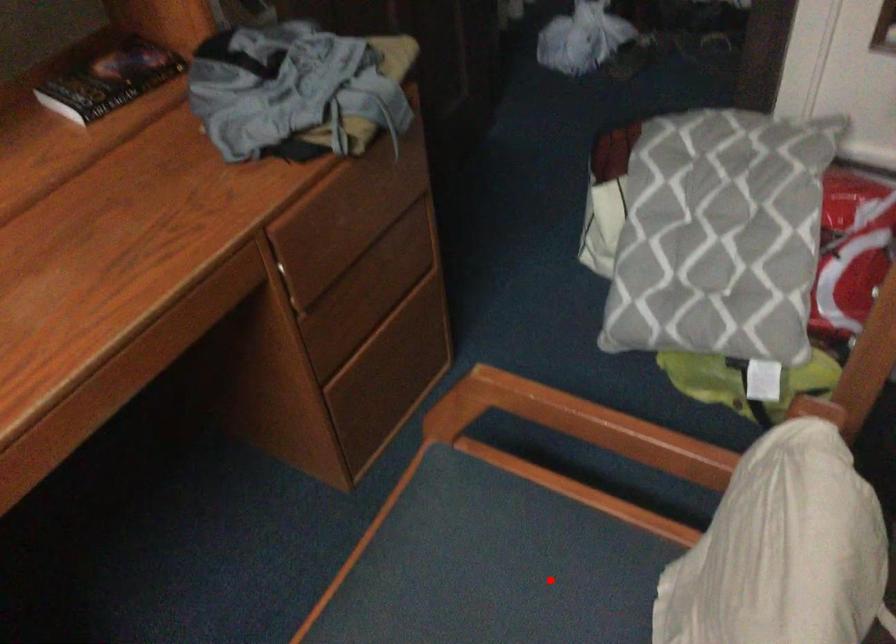
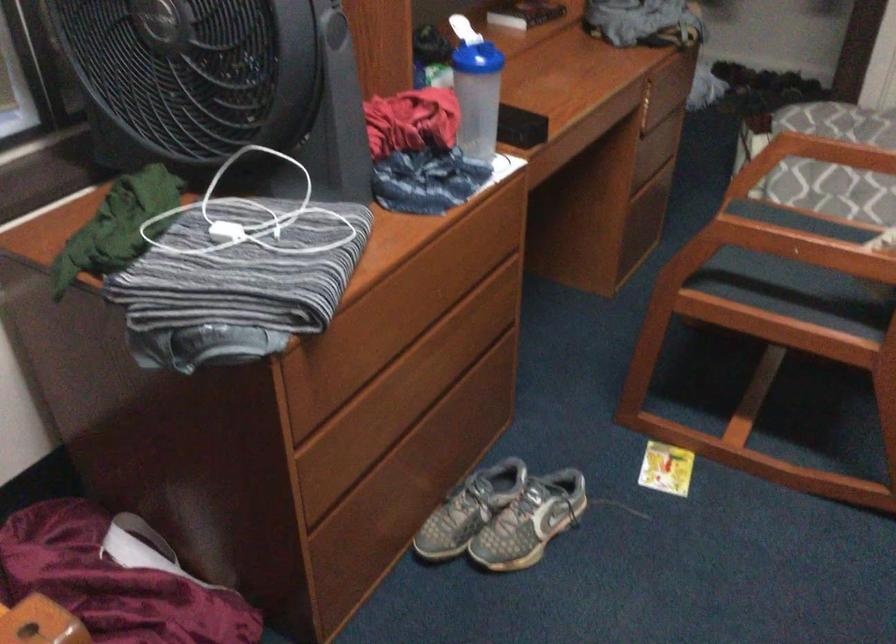
Question: I am providing you with two images of the same scene from different viewpoints. A red point is marked on the first image. Is the red point's position out of view in image 2?

Choices:
 (A) Yes
 (B) No

Answer: (A)